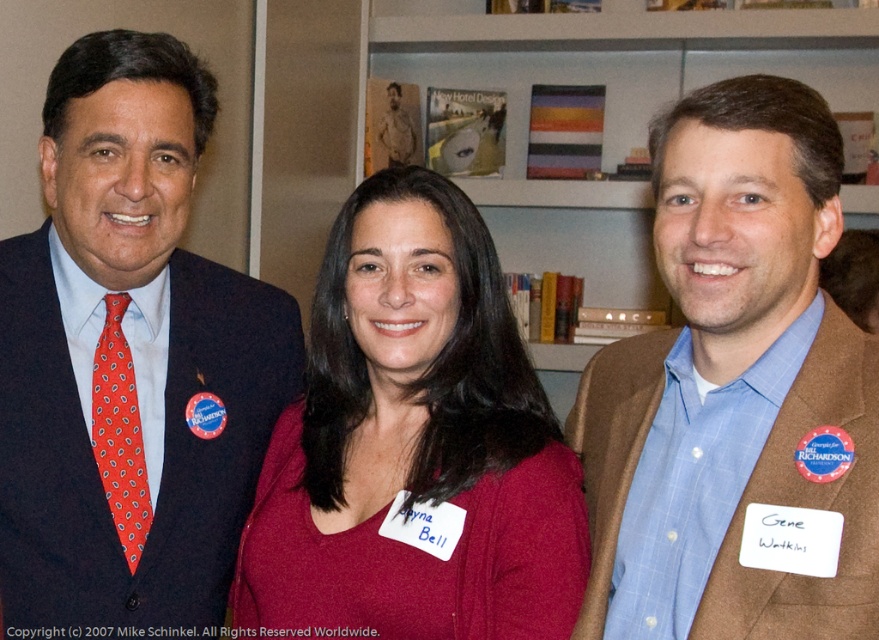
You are a photographer taking a picture of the scene. You notice the brown textured blazer at center and the hardcover books at upper center. Which object should you focus on first to ensure both are in sharp focus?

The brown textured blazer at center is closer to the viewer than the hardcover books at upper center. To ensure both are in sharp focus, focus on the brown textured blazer at center first since it is the closer object.

You are an event organizer who needs to arrange name tags for attendees. The name tags are 10 cm wide. You see the matte black suit at left and the hardcover books at upper center. Which object has enough space to fit a name tag without overlapping other items?

The hardcover books at upper center have a greater width than the matte black suit at left, so the name tag can fit on the hardcover books at upper center without overlapping other items.

You are an event planner who needs to adjust the spacing between the brown textured blazer at center and the hardcover books at upper center to ensure they are exactly 2 meters apart. Given their current distance is 2.03 meters, how much do you need to move one of them to achieve the desired distance?

The brown textured blazer at center and hardcover books at upper center are currently 2.03 meters apart. To reduce the distance to exactly 2 meters, you need to move one of them by 0.03 meters toward the other.